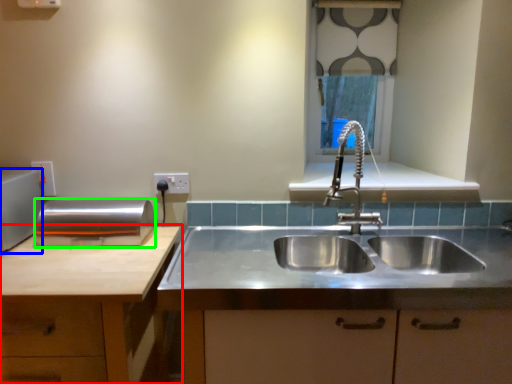
Question: Estimate the real-world distances between objects in this image. Which object is farther from cabinetry (highlighted by a red box), appliance (highlighted by a blue box) or appliance (highlighted by a green box)?

Choices:
 (A) appliance
 (B) appliance

Answer: (A)